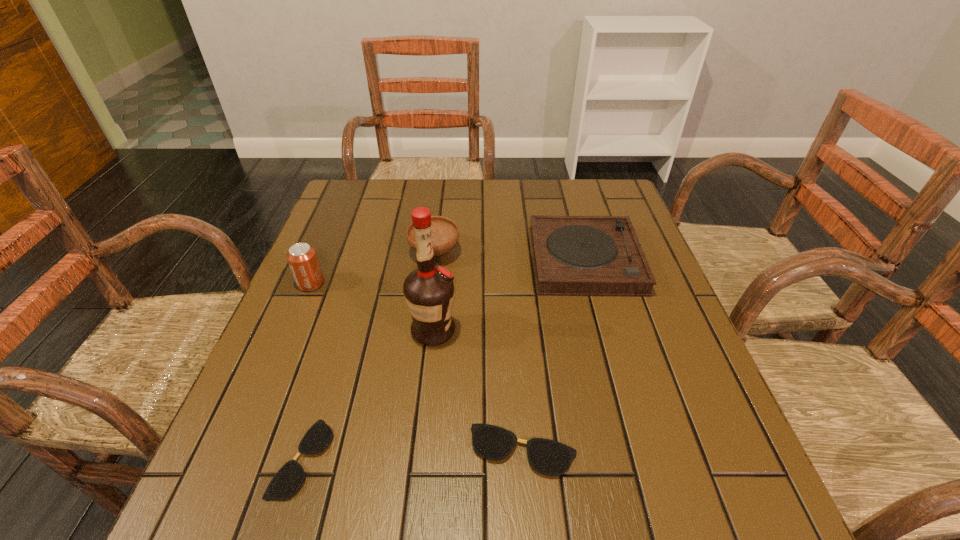
Find the location of `the second object from left to right`. the second object from left to right is located at coordinates (286, 482).

Where is `the left spectacles`? The height and width of the screenshot is (540, 960). the left spectacles is located at coordinates (286, 482).

Locate an element on the screen. the second shortest object is located at coordinates (552, 458).

The width and height of the screenshot is (960, 540). Identify the location of the right spectacles. (552, 458).

This screenshot has width=960, height=540. What are the coordinates of `bowl` in the screenshot? It's located at click(x=444, y=232).

Locate an element on the screen. The width and height of the screenshot is (960, 540). phonograph record is located at coordinates pyautogui.click(x=572, y=255).

Where is `the tallest object`? The height and width of the screenshot is (540, 960). the tallest object is located at coordinates (429, 290).

Identify the location of the fourth farthest object. click(429, 290).

Where is `can`? This screenshot has height=540, width=960. can is located at coordinates (302, 258).

Locate an element on the screen. the leftmost object is located at coordinates (302, 258).